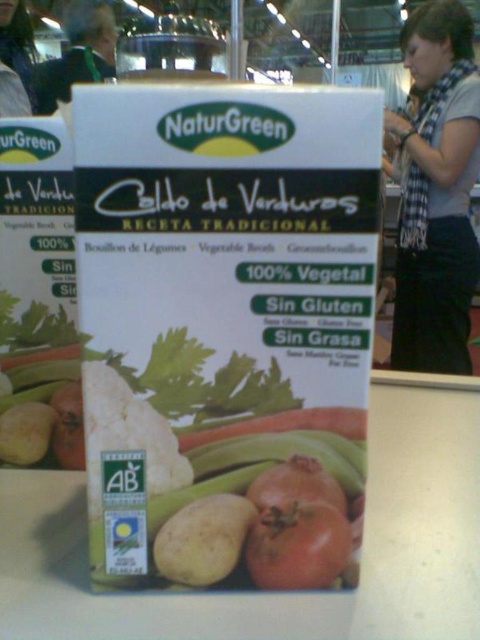
Question: From the image, what is the correct spatial relationship of green fabric at upper left in relation to pomegranate at center?

Choices:
 (A) above
 (B) below

Answer: (A)

Question: Is orange smooth carrot at center below pomegranate at center?

Choices:
 (A) no
 (B) yes

Answer: (A)

Question: Which of the following is the farthest from the observer?

Choices:
 (A) green fabric at upper left
 (B) matte yellowish potato at lower left

Answer: (A)

Question: Which object is farther from the camera taking this photo?

Choices:
 (A) matte yellowish potato at lower left
 (B) green fabric at upper left
 (C) blue plaid scarf at upper right

Answer: (B)

Question: Which object is farther from the camera taking this photo?

Choices:
 (A) shiny red tomato at center
 (B) matte yellowish potato at lower left

Answer: (B)

Question: Considering the relative positions of orange smooth carrot at center and pomegranate at center in the image provided, where is orange smooth carrot at center located with respect to pomegranate at center?

Choices:
 (A) right
 (B) left

Answer: (B)